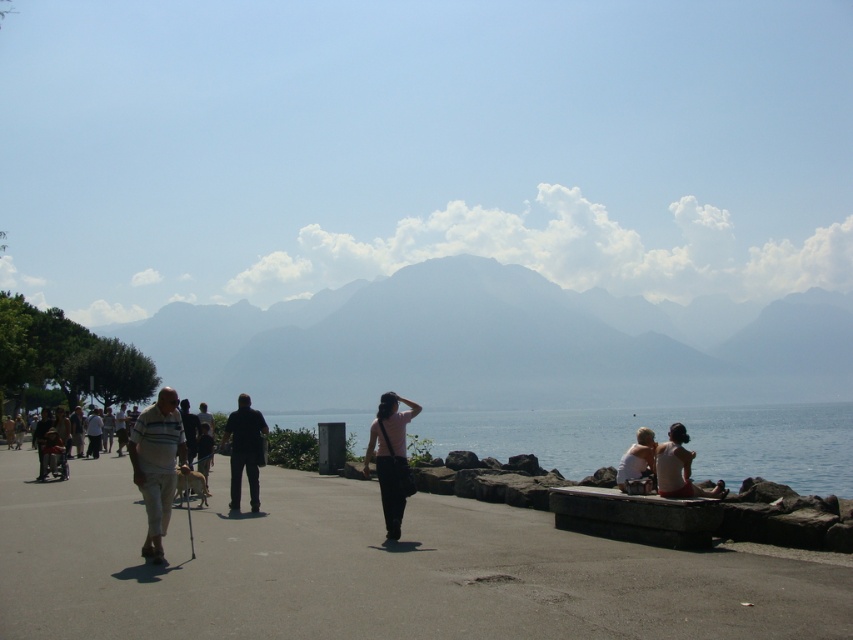
Between point (236, 397) and point (625, 467), which one is positioned in front?

Point (625, 467) is in front.

Is point (231, 484) positioned before point (637, 460)?

That is False.

You are a GUI agent. You are given a task and a screenshot of the screen. Output one action in this format:
    pyautogui.click(x=<x>, y=<y>)
    Task: Click on the dark gray pants at center
    
    Given the screenshot: What is the action you would take?
    pyautogui.click(x=244, y=449)

The height and width of the screenshot is (640, 853). What are the coordinates of `dark gray pants at center` in the screenshot? It's located at (244, 449).

Which is more to the right, pink fabric shirt at center or dark gray pants at center?

pink fabric shirt at center

Who is lower down, pink fabric shirt at center or dark gray pants at center?

dark gray pants at center is below.

Find the location of `pink fabric shirt at center`. pink fabric shirt at center is located at coordinates (390, 456).

Between point (68, 554) and point (393, 445), which one is positioned behind?

The point (393, 445) is behind.

Does concrete sidewalk at center have a greater width compared to pink fabric shirt at center?

Correct, the width of concrete sidewalk at center exceeds that of pink fabric shirt at center.

Does point (428, 620) lie in front of point (392, 451)?

Yes, point (428, 620) is in front of point (392, 451).

Identify the location of concrete sidewalk at center. This screenshot has width=853, height=640. (370, 568).